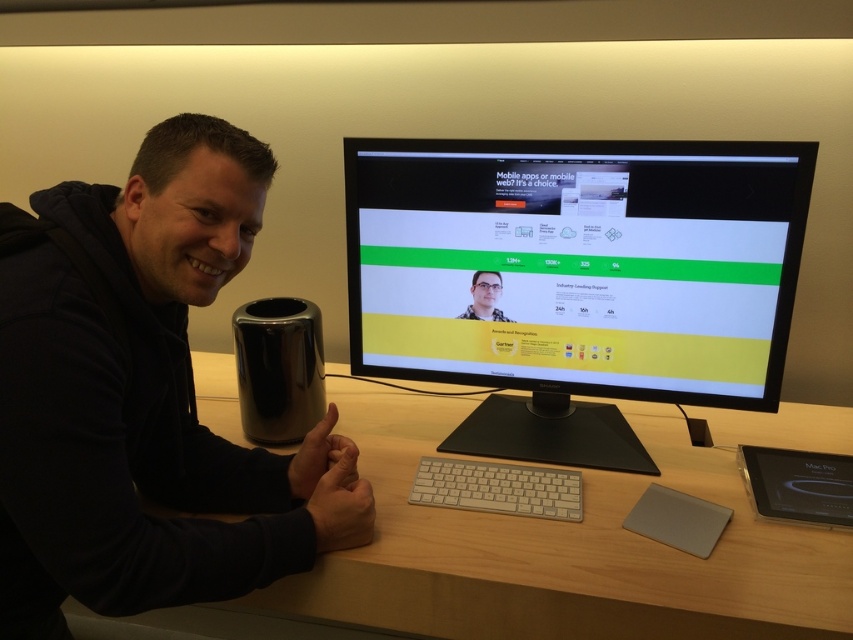
You are a photographer trying to capture a closeup of the monitor on the desk. You notice two points marked on the desk surface. One is at point (698, 605) and the other at point (273, 362). Which of these points is closer to the camera and thus better for placing a prop to ensure it appears larger in the photo?

Point (698, 605) is closer to the camera than point (273, 362), so placing a prop there would make it appear larger in the photo.

You are standing in front of the desk and want to place a small sticker on either the point at coordinates (x=662, y=212) or the point at (x=514, y=492). Which point is closer to you so that the sticker will be more visible?

Point at coordinates (x=662, y=212) is closer to you than point at (x=514, y=492), so placing the sticker there will make it more visible.

You are setting up a new desk setup and want to place a small plant between the black glossy monitor at center and the black matte speaker at left. Based on their positions, where should you place the plant to ensure it is between both objects?

The black matte speaker at left is behind the black glossy monitor at center, so to place the plant between them, position it in front of the black matte speaker at left and behind the black glossy monitor at center.